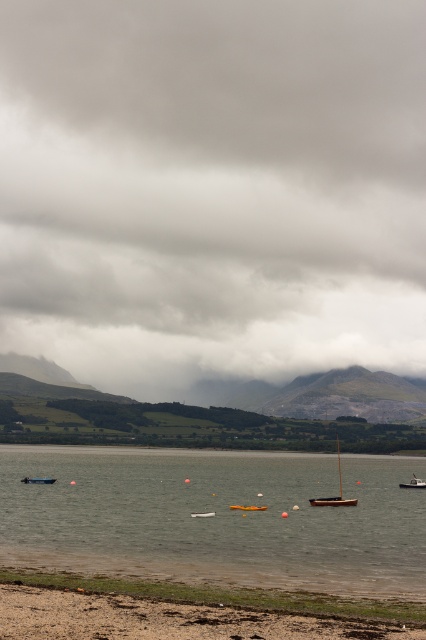
Between point (317, 499) and point (412, 484), which one is positioned behind?

The point (412, 484) is behind.

Can you confirm if wooden sailboat at center is smaller than white plastic boat at center?

No, wooden sailboat at center is not smaller than white plastic boat at center.

Locate an element on the screen. Image resolution: width=426 pixels, height=640 pixels. wooden sailboat at center is located at coordinates (339, 490).

Locate an element on the screen. This screenshot has width=426, height=640. wooden sailboat at center is located at coordinates (339, 490).

Is clear water at lower center in front of white plastic boat at center?

Yes, it is.

Can you confirm if clear water at lower center is thinner than white plastic boat at center?

Incorrect, clear water at lower center's width is not less than white plastic boat at center's.

Between point (11, 529) and point (412, 483), which one is positioned in front?

Point (11, 529)

The image size is (426, 640). Identify the location of clear water at lower center. (216, 516).

What do you see at coordinates (339, 490) in the screenshot? This screenshot has height=640, width=426. I see `wooden sailboat at center` at bounding box center [339, 490].

Between wooden sailboat at center and white plastic kayak at center, which one has less height?

Standing shorter between the two is white plastic kayak at center.

Find the location of a particular element. Image resolution: width=426 pixels, height=640 pixels. wooden sailboat at center is located at coordinates (339, 490).